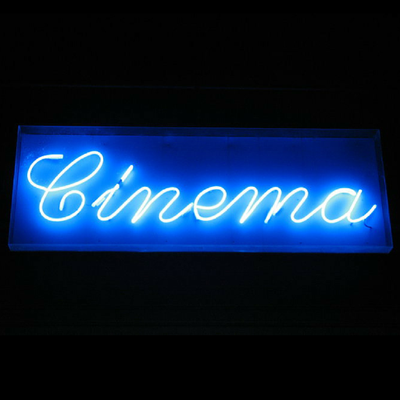
Locate an element on the screen. The image size is (400, 400). bottom right corner of neon sign is located at coordinates (388, 243).